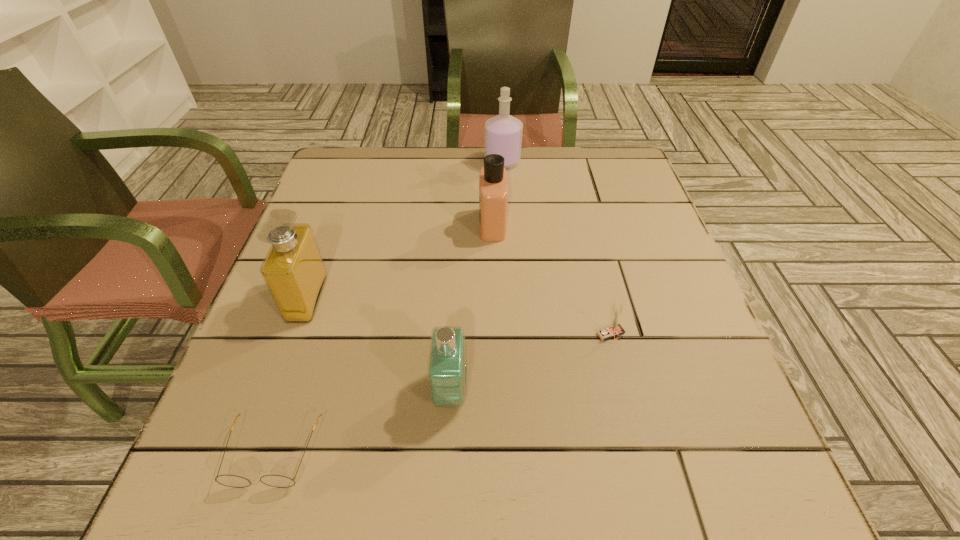
Where is `free space located on the front-facing side of the third farthest object`? Image resolution: width=960 pixels, height=540 pixels. free space located on the front-facing side of the third farthest object is located at coordinates (399, 298).

The image size is (960, 540). Identify the location of vacant space situated 0.270m on the front label of the third nearest perfume. (368, 224).

The width and height of the screenshot is (960, 540). What are the coordinates of `free space located 0.330m on the front label of the third nearest perfume` in the screenshot? It's located at (343, 224).

At what (x,y) coordinates should I click in order to perform the action: click on free space located on the front label of the third nearest perfume. Please return your answer as a coordinate pair (x, y). The image size is (960, 540). Looking at the image, I should click on (363, 224).

Find the location of `vacant space located 0.070m on the front label of the nearest perfume`. vacant space located 0.070m on the front label of the nearest perfume is located at coordinates (508, 391).

This screenshot has width=960, height=540. What are the coordinates of `free location located on the back of the rightmost object` in the screenshot? It's located at (586, 235).

What are the coordinates of `object at the far edge` in the screenshot? It's located at (503, 133).

Find the location of a particular element. The image size is (960, 540). object located at the near edge is located at coordinates (278, 481).

What are the coordinates of `perfume at the left edge` in the screenshot? It's located at (293, 270).

Where is `spectacles present at the left edge`? spectacles present at the left edge is located at coordinates (278, 481).